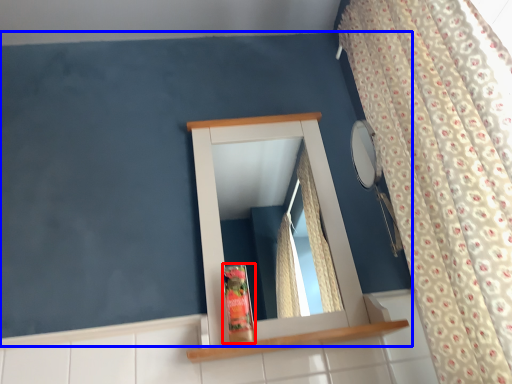
Question: Among these objects, which one is farthest to the camera, toiletry (highlighted by a red box) or backdrop (highlighted by a blue box)?

Choices:
 (A) toiletry
 (B) backdrop

Answer: (A)